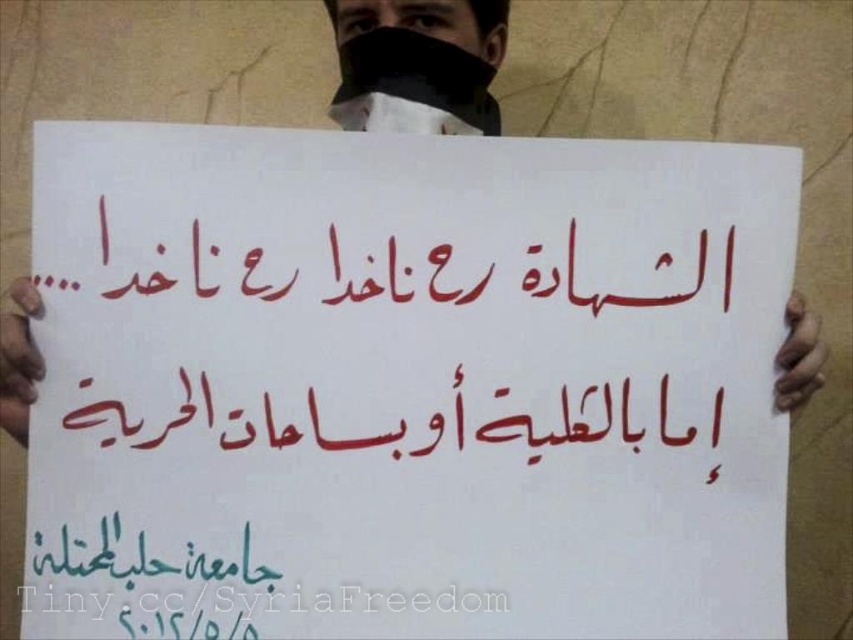
What is the significance of the point at coordinates [405,385] in the image?

The point at coordinates [405,385] marks the location of the white paper sign at center in the image.

What is the relationship between the red calligraphy at center and the white paper at center in terms of their vertical positioning?

The red calligraphy at center is located below the white paper at center.

You are a photographer trying to capture a clear image of the white paper sign at center and the black fabric mask at upper center. Which object should you focus on first to ensure both are in sharp focus?

You should focus on the white paper sign at center first because it is closer to the viewer than the black fabric mask at upper center, so adjusting focus from the closer object to the farther one will help both be in sharp focus.